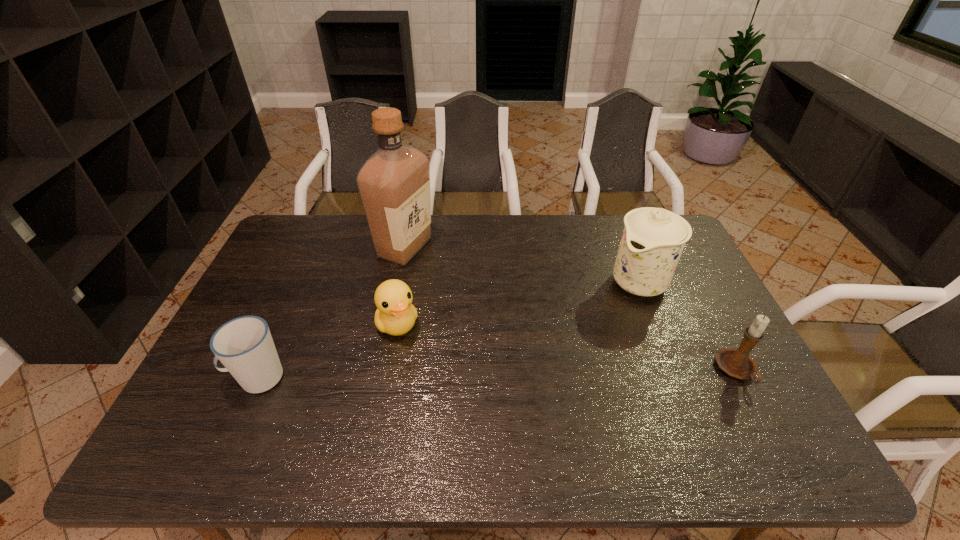
Locate an element on the screen. The image size is (960, 540). vacant spot on the desktop that is between the cup and the candle holder and is positioned on the front-facing side of the tallest object is located at coordinates (506, 374).

I want to click on free space on the desktop that is between the cup and the candle holder and is positioned on the spout of the fourth shortest object, so click(x=538, y=373).

You are a GUI agent. You are given a task and a screenshot of the screen. Output one action in this format:
    pyautogui.click(x=<x>, y=<y>)
    Task: Click on the vacant space on the desktop that is between the cup and the candle holder and is positioned on the face of the third nearest object
    Image resolution: width=960 pixels, height=540 pixels.
    Given the screenshot: What is the action you would take?
    pyautogui.click(x=428, y=375)